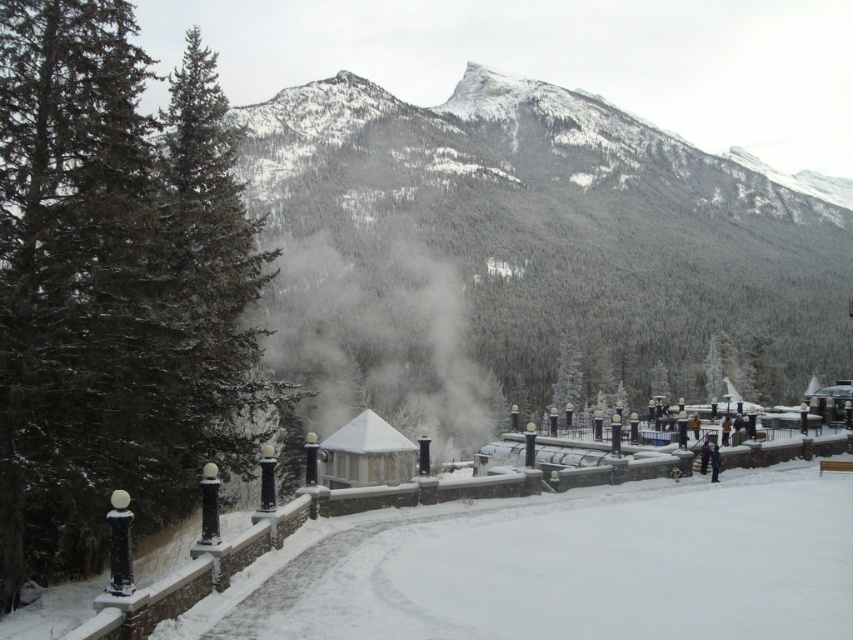
Question: Does green matte tree at left appear under white foggy steam at center?

Choices:
 (A) no
 (B) yes

Answer: (A)

Question: Based on their relative distances, which object is nearer to the snowy forested mountain at upper center?

Choices:
 (A) white foggy steam at center
 (B) green matte tree at left

Answer: (A)

Question: Based on their relative distances, which object is farther from the snowy forested mountain at upper center?

Choices:
 (A) white foggy steam at center
 (B) green matte tree at left

Answer: (B)

Question: Is green matte tree at left positioned behind snowy forested mountain at upper center?

Choices:
 (A) no
 (B) yes

Answer: (A)

Question: Which point is farther to the camera?

Choices:
 (A) snowy forested mountain at upper center
 (B) green matte tree at left
 (C) white foggy steam at center

Answer: (A)

Question: Observing the image, what is the correct spatial positioning of green matte tree at left in reference to snowy forested mountain at upper center?

Choices:
 (A) left
 (B) right

Answer: (A)